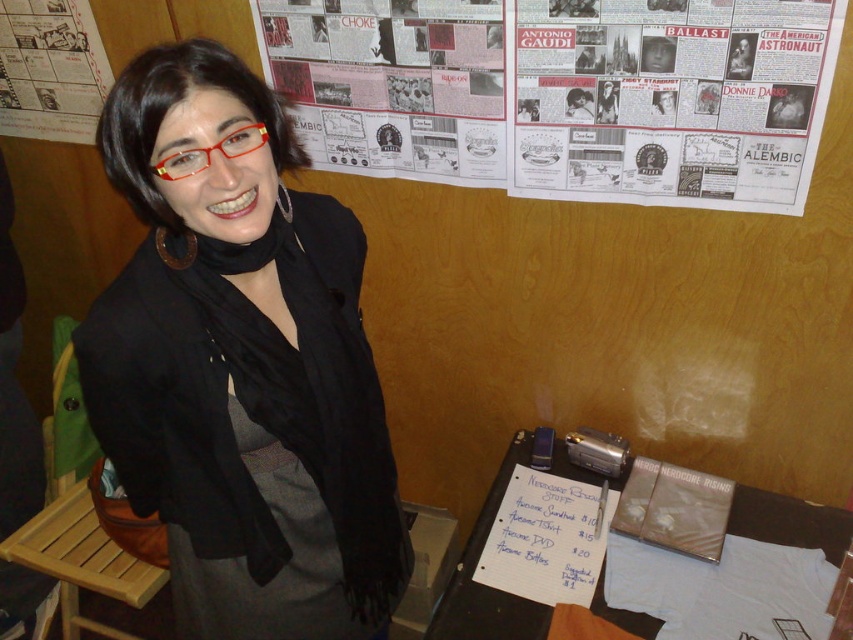
Who is lower down, black matte scarf at center or white paper posters at upper center?

Positioned lower is black matte scarf at center.

Describe the element at coordinates (241, 364) in the screenshot. I see `black matte scarf at center` at that location.

I want to click on black matte scarf at center, so click(241, 364).

Which is more to the right, black matte scarf at center or printed paper poster at upper left?

Positioned to the right is black matte scarf at center.

Between point (207, 573) and point (30, 100), which one is positioned in front?

Point (207, 573)

Which is in front, point (109, 154) or point (25, 12)?

Point (109, 154) is more forward.

What are the coordinates of `black matte scarf at center` in the screenshot? It's located at (241, 364).

Which is more to the left, white paper posters at upper center or printed paper poster at upper left?

From the viewer's perspective, printed paper poster at upper left appears more on the left side.

Can you confirm if white paper posters at upper center is taller than printed paper poster at upper left?

→ Yes, white paper posters at upper center is taller than printed paper poster at upper left.

Is point (614, 4) farther from camera compared to point (67, 125)?

That is False.

This screenshot has height=640, width=853. I want to click on white paper posters at upper center, so click(x=590, y=96).